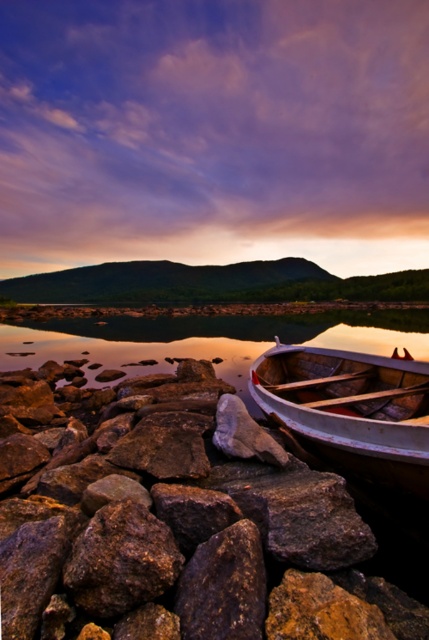
Does wooden boat at lower right appear over glossy water at boat right?

Actually, wooden boat at lower right is below glossy water at boat right.

You are a GUI agent. You are given a task and a screenshot of the screen. Output one action in this format:
    pyautogui.click(x=<x>, y=<y>)
    Task: Click on the wooden boat at lower right
    
    Given the screenshot: What is the action you would take?
    pyautogui.click(x=352, y=410)

Is brown rough rock at center to the right of glossy water at boat right from the viewer's perspective?

Indeed, brown rough rock at center is positioned on the right side of glossy water at boat right.

At what (x,y) coordinates should I click in order to perform the action: click on brown rough rock at center. Please return your answer as a coordinate pair (x, y). Image resolution: width=429 pixels, height=640 pixels. Looking at the image, I should click on (178, 529).

Does point (30, 394) come behind point (54, 326)?

No, (30, 394) is in front of (54, 326).

Locate an element on the screen. This screenshot has height=640, width=429. brown rough rock at center is located at coordinates tap(178, 529).

Image resolution: width=429 pixels, height=640 pixels. Describe the element at coordinates (178, 529) in the screenshot. I see `brown rough rock at center` at that location.

Between brown rough rock at center and wooden boat at lower right, which one has less height?

Standing shorter between the two is wooden boat at lower right.

This screenshot has height=640, width=429. What are the coordinates of `brown rough rock at center` in the screenshot? It's located at (178, 529).